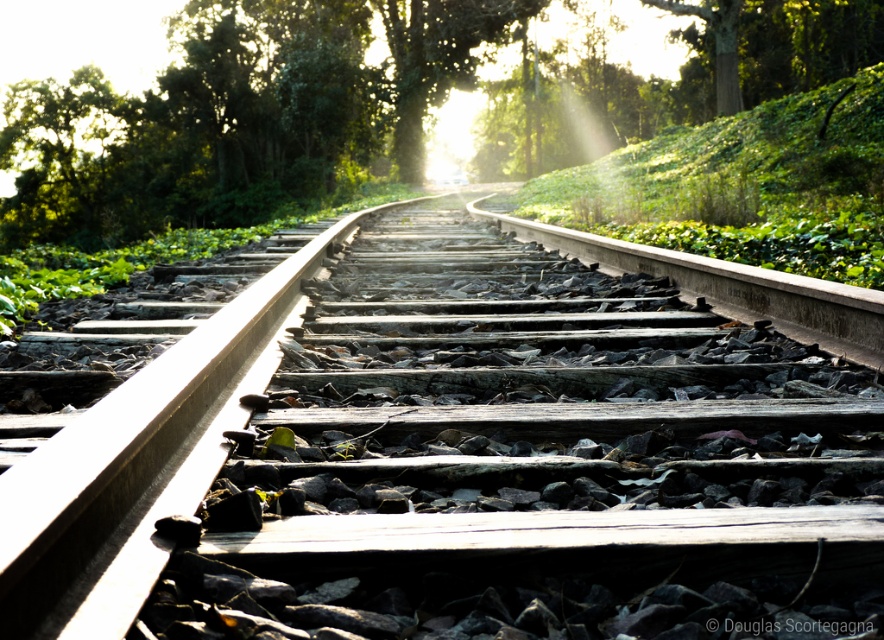
Who is more distant from viewer, (409, 385) or (656, 99)?

The point (656, 99) is behind.

Between wooden track at center and green leafy tree at center, which one has less height?

wooden track at center is shorter.

Between point (587, 554) and point (216, 104), which one is positioned behind?

Point (216, 104)

Locate an element on the screen. This screenshot has width=884, height=640. wooden track at center is located at coordinates (442, 454).